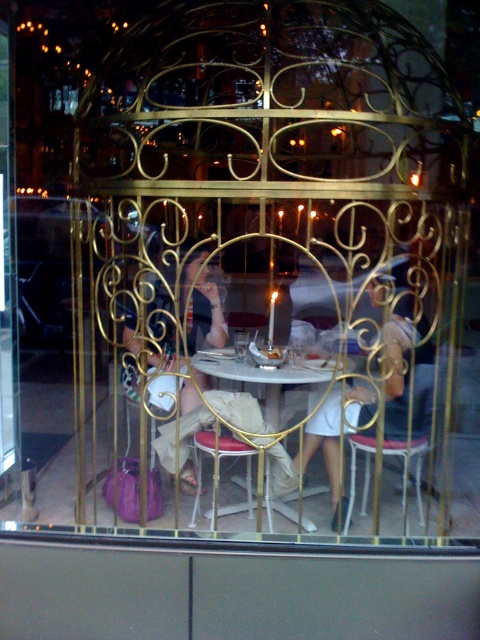
Question: Which point is closer to the camera taking this photo?

Choices:
 (A) (385, 429)
 (B) (415, 324)
 (C) (215, 305)
 (D) (257, 376)

Answer: (B)

Question: Is white matte dress at center positioned in front of matte black dress at center?

Choices:
 (A) no
 (B) yes

Answer: (B)

Question: Which point is farther to the camera?

Choices:
 (A) matte black dress at center
 (B) white glossy table at center

Answer: (B)

Question: Is white matte dress at center smaller than matte black dress at center?

Choices:
 (A) yes
 (B) no

Answer: (A)

Question: Can you confirm if matte black dress at center is wider than smooth leather chair at center?

Choices:
 (A) no
 (B) yes

Answer: (B)

Question: Which point is farther to the camera?

Choices:
 (A) white glossy table at center
 (B) white matte dress at center
 (C) smooth leather chair at center

Answer: (A)